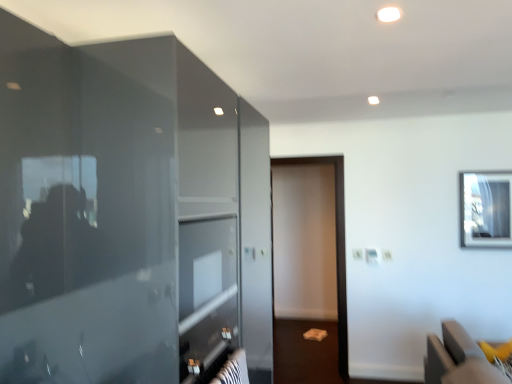
Question: Is yellow fabric cushion at lower right looking in the opposite direction of clear glass window at upper right?

Choices:
 (A) yes
 (B) no

Answer: (B)

Question: Does yellow fabric cushion at lower right have a greater height compared to clear glass window at upper right?

Choices:
 (A) yes
 (B) no

Answer: (B)

Question: Can you confirm if yellow fabric cushion at lower right is shorter than clear glass window at upper right?

Choices:
 (A) yes
 (B) no

Answer: (A)

Question: Considering the relative sizes of yellow fabric cushion at lower right and clear glass window at upper right in the image provided, is yellow fabric cushion at lower right thinner than clear glass window at upper right?

Choices:
 (A) no
 (B) yes

Answer: (A)

Question: From a real-world perspective, is yellow fabric cushion at lower right located beneath clear glass window at upper right?

Choices:
 (A) no
 (B) yes

Answer: (B)

Question: Can you confirm if yellow fabric cushion at lower right is wider than clear glass window at upper right?

Choices:
 (A) no
 (B) yes

Answer: (B)

Question: Can you confirm if clear glass window at upper right is positioned to the right of glossy glass door at left?

Choices:
 (A) no
 (B) yes

Answer: (B)

Question: Considering the relative sizes of clear glass window at upper right and glossy glass door at left in the image provided, is clear glass window at upper right smaller than glossy glass door at left?

Choices:
 (A) no
 (B) yes

Answer: (B)

Question: Does clear glass window at upper right have a larger size compared to glossy glass door at left?

Choices:
 (A) no
 (B) yes

Answer: (A)

Question: Considering the relative positions of clear glass window at upper right and glossy glass door at left in the image provided, is clear glass window at upper right behind glossy glass door at left?

Choices:
 (A) no
 (B) yes

Answer: (B)

Question: Is clear glass window at upper right closer to the viewer compared to glossy glass door at left?

Choices:
 (A) no
 (B) yes

Answer: (A)

Question: Is clear glass window at upper right wider than glossy glass door at left?

Choices:
 (A) no
 (B) yes

Answer: (A)

Question: Is clear glass window at upper right wider than yellow fabric cushion at lower right?

Choices:
 (A) yes
 (B) no

Answer: (B)